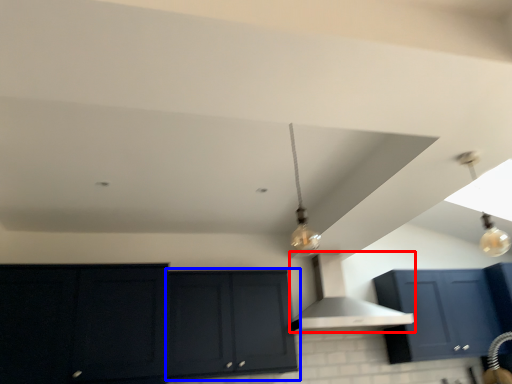
Question: Which object appears farthest to the camera in this image, vent (highlighted by a red box) or cabinetry (highlighted by a blue box)?

Choices:
 (A) vent
 (B) cabinetry

Answer: (A)